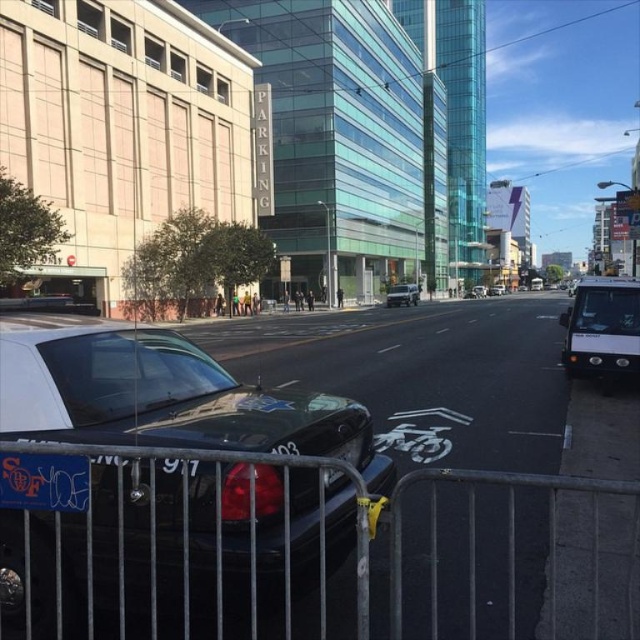
You are standing at the point with coordinates (401, 544) in the image. What object is located at this point?

The metallic silver fence at lower center is located at point (401, 544).

You are a pedestrian standing at the intersection and see both the matte black police car at center and the white matte van at right. Which vehicle is closer to you?

The matte black police car at center is closer to you because it is in front of the white matte van at right, indicating it is positioned nearer in the scene.